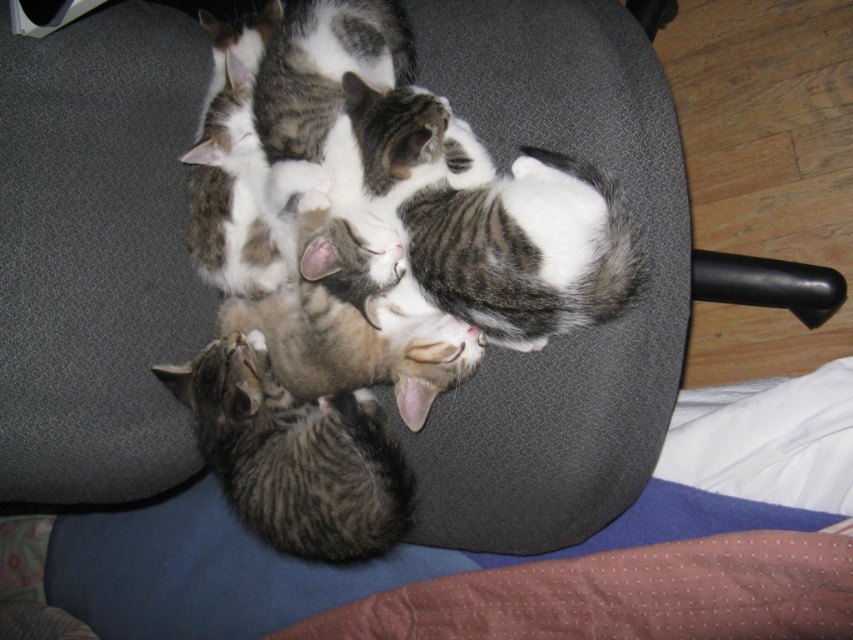
You are a photographer standing 40 inches away from a gray office chair cushion where a tabby fur cat at center is resting. Can you safely take a photo without getting too close to the cat?

The tabby fur cat at center is 36.83 inches away from the viewer. Since you are standing 40 inches away, you are slightly farther than the cat, so you can safely take the photo without getting too close.

You are an animal behaviorist observing cats in an office environment. You notice a point marked at coordinates (x=531, y=448). Which cat is located at this point?

The point at (x=531, y=448) indicates the tabby fur cat at center.